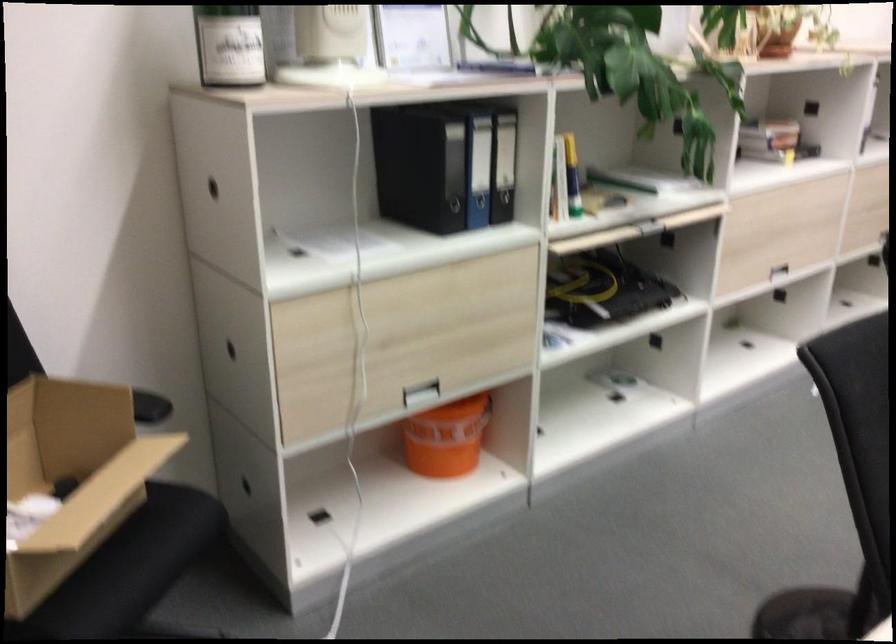
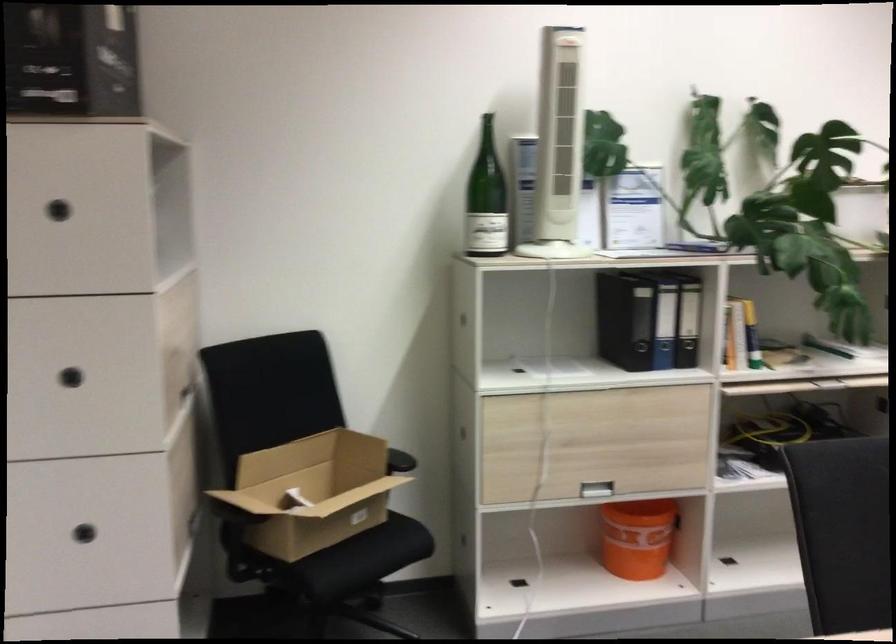
Where in the second image is the point corresponding to pixel 460 438 from the first image?

(636, 538)